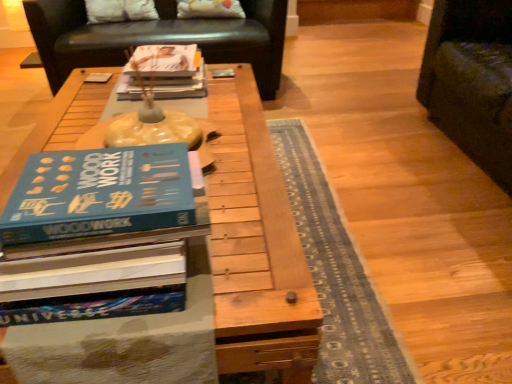
At what (x,y) coordinates should I click in order to perform the action: click on free space above matte paper book at center (from a real-world perspective). Please return your answer as a coordinate pair (x, y). Looking at the image, I should click on (160, 64).